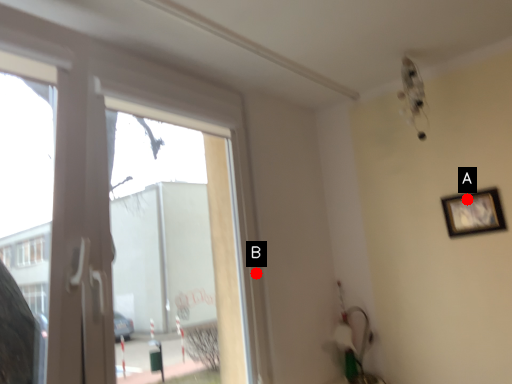
Question: Two points are circled on the image, labeled by A and B beside each circle. Among these points, which one is nearest to the camera?

Choices:
 (A) A is closer
 (B) B is closer

Answer: (B)